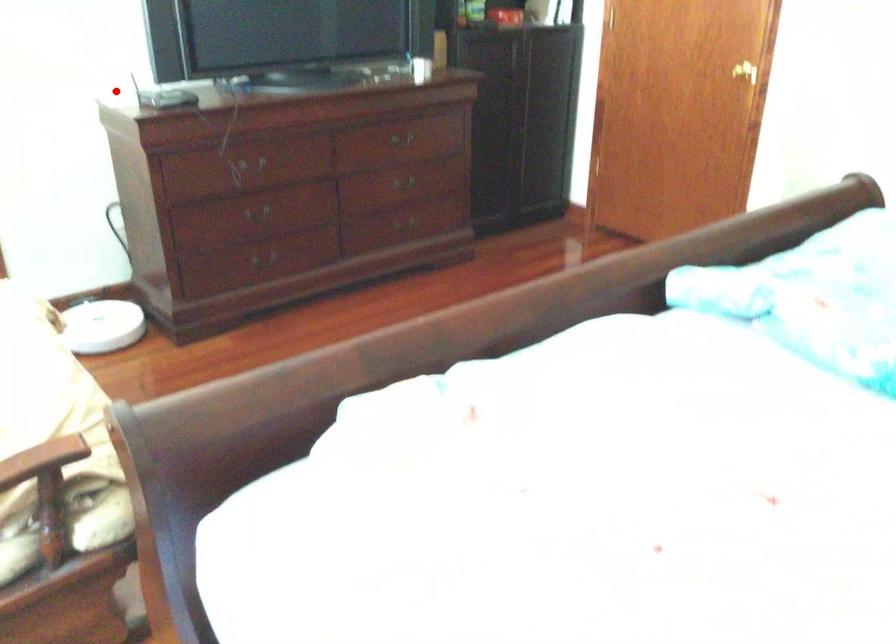
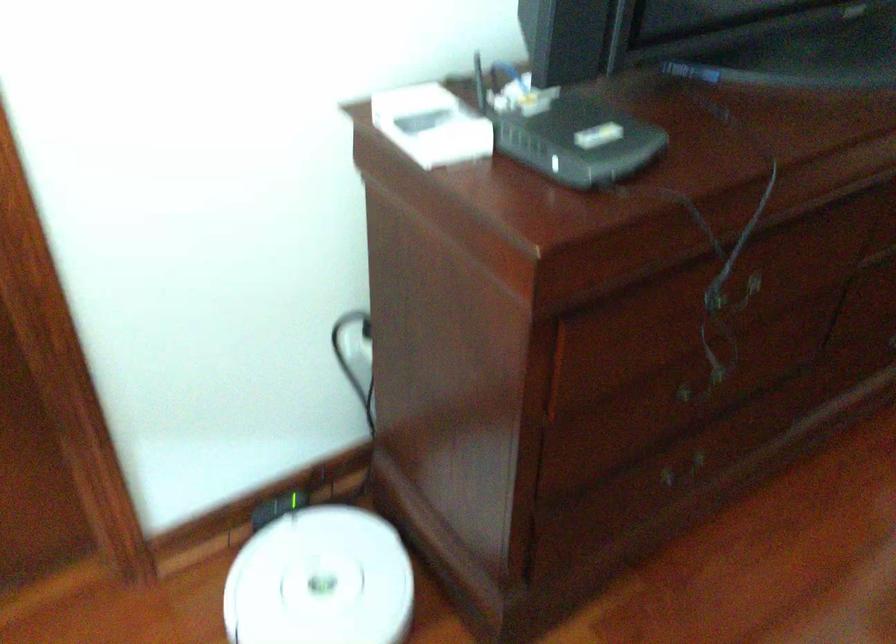
Question: I am providing you with two images of the same scene from different viewpoints. Given a red point in image1, look at the same physical point in image2. Is it:

Choices:
 (A) Closer to the viewpoint
 (B) Farther from the viewpoint

Answer: (A)